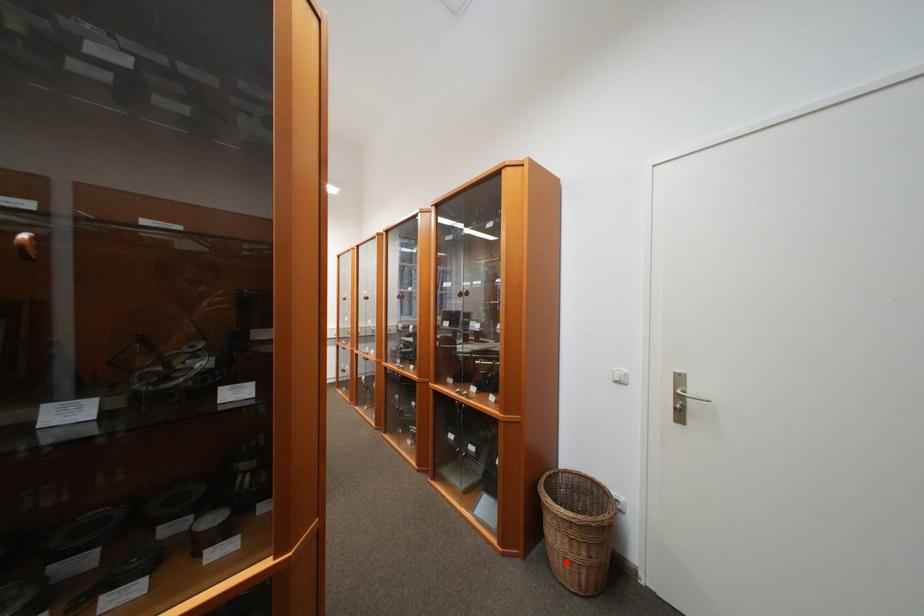
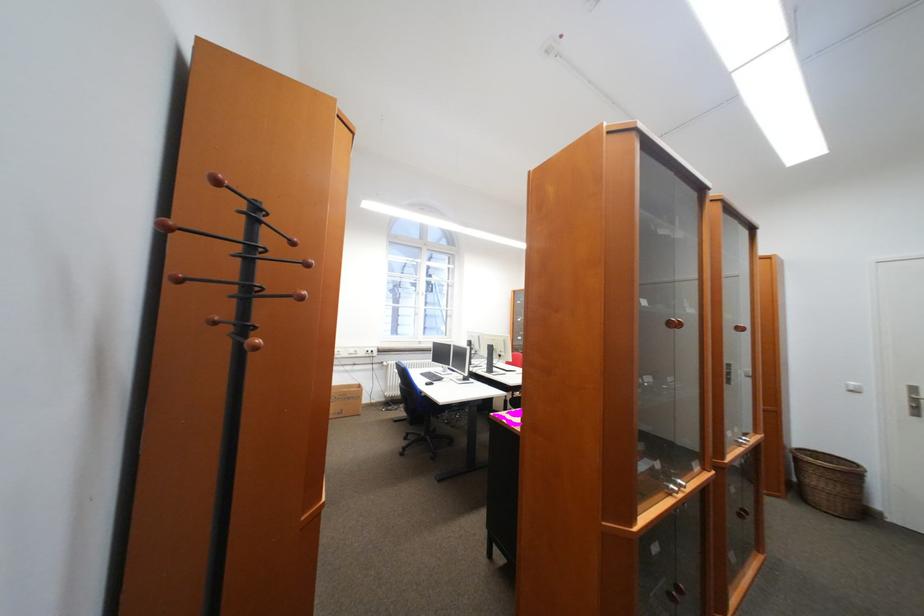
Locate, in the second image, the point that corresponds to the highlighted location in the first image.

(830, 499)